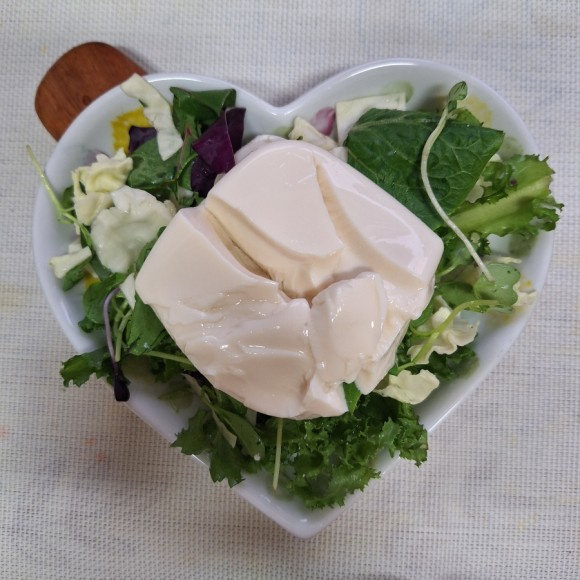
Locate an element on the screen. This screenshot has width=580, height=580. white tabel cloth is located at coordinates (435, 536).